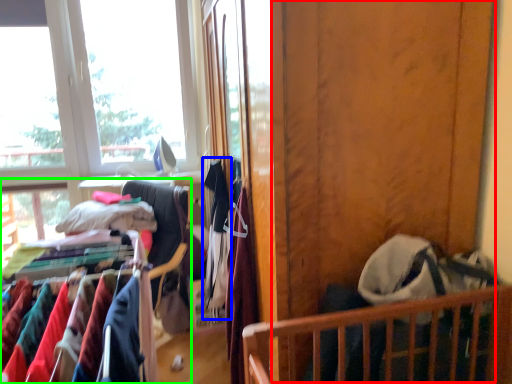
Question: Which object is the farthest from screen door (highlighted by a red box)? Choose among these: clothing (highlighted by a blue box) or closet (highlighted by a green box).

Choices:
 (A) clothing
 (B) closet

Answer: (B)